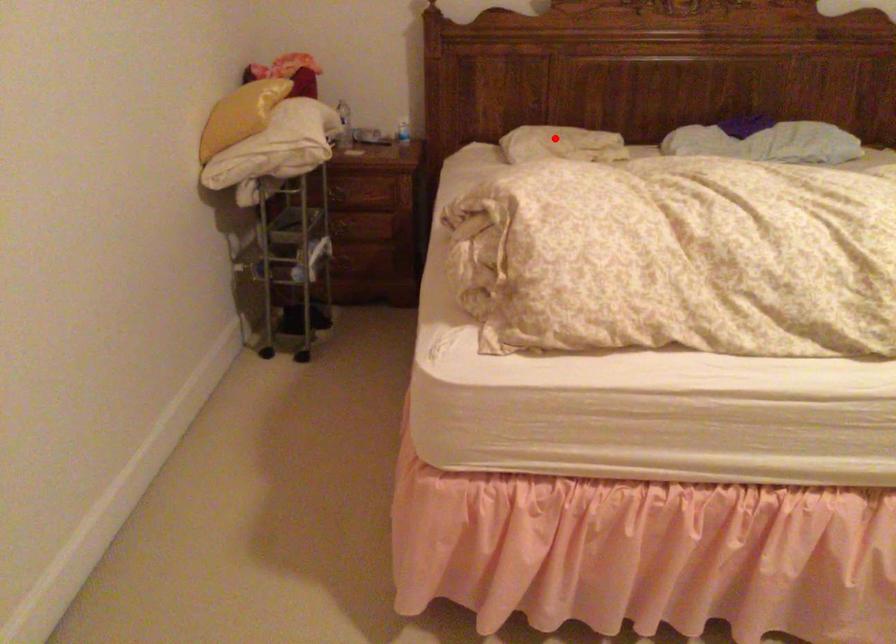
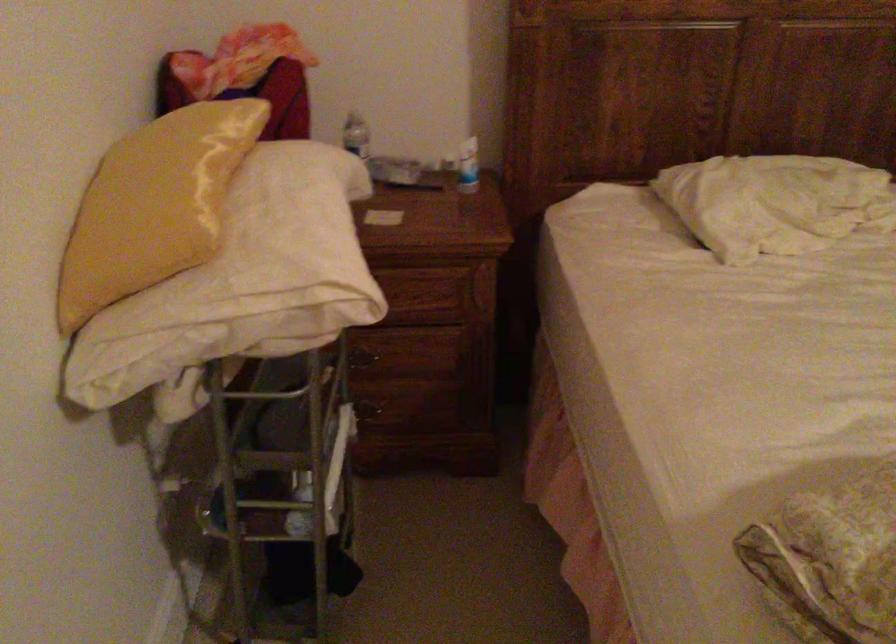
Find the pixel in the second image that matches the highlighted location in the first image.

(774, 202)